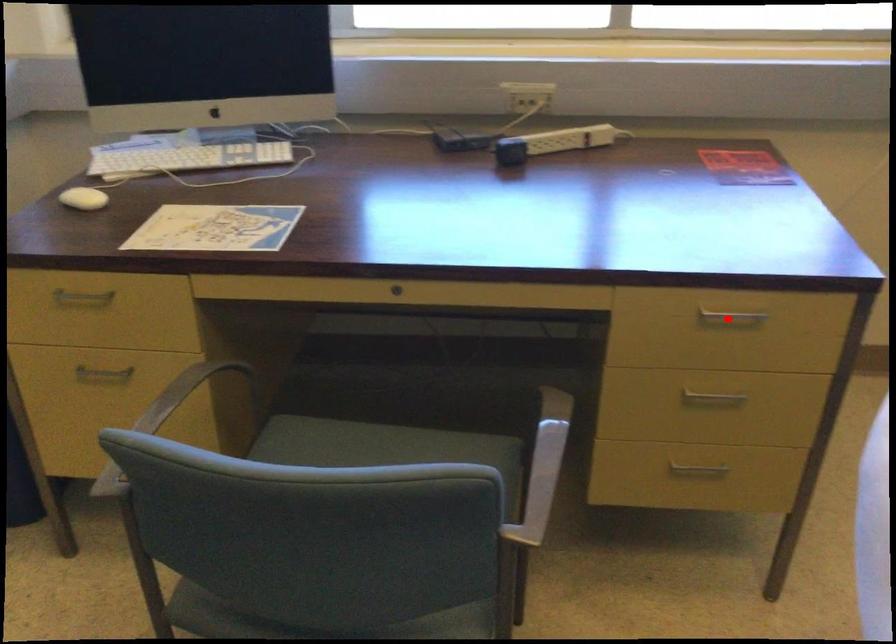
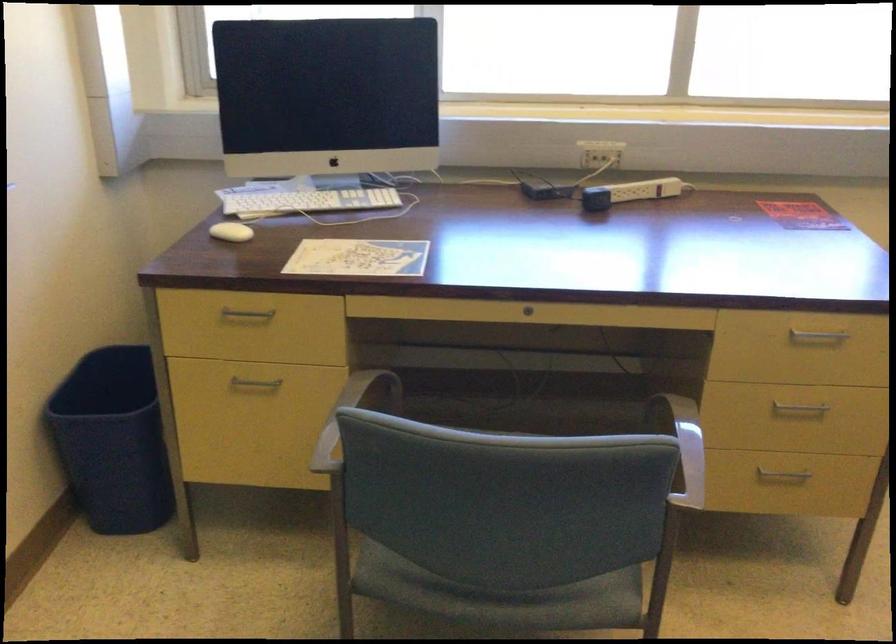
Find the pixel in the second image that matches the highlighted location in the first image.

(816, 336)